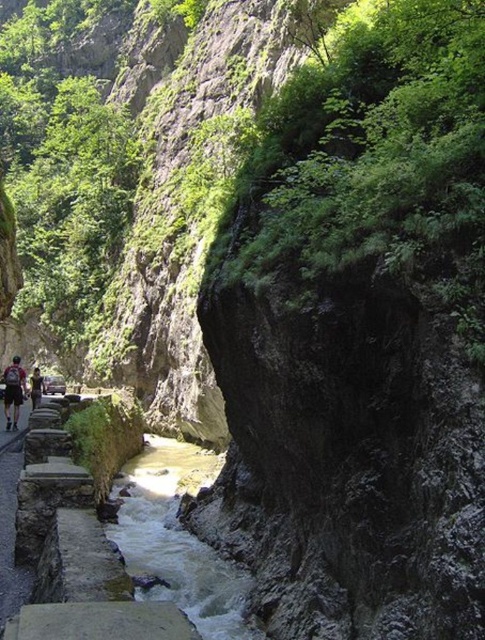
Is point (16, 420) positioned after point (35, 380)?

That is False.

Between dark gray backpack at left and dark blue jeans at left, which one appears on the right side from the viewer's perspective?

dark blue jeans at left is more to the right.

Does point (15, 380) lie behind point (38, 378)?

No, it is not.

The height and width of the screenshot is (640, 485). Find the location of `dark gray backpack at left`. dark gray backpack at left is located at coordinates (14, 392).